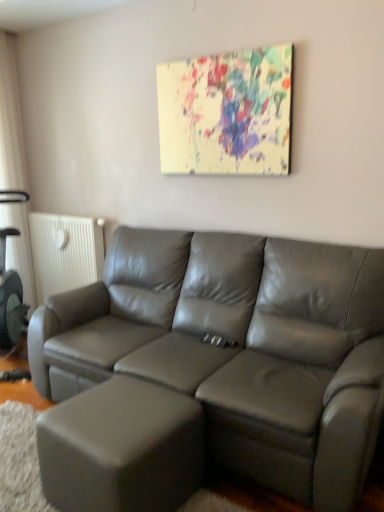
Question: In the image, is painted canvas at upper center positioned in front of or behind matte gray ottoman at lower left?

Choices:
 (A) front
 (B) behind

Answer: (B)

Question: Is painted canvas at upper center taller or shorter than matte gray ottoman at lower left?

Choices:
 (A) tall
 (B) short

Answer: (A)

Question: Estimate the real-world distances between objects in this image. Which object is closer to the matte gray ottoman at lower left?

Choices:
 (A) painted canvas at upper center
 (B) white textured radiator at left
 (C) satin gray leather couch at center

Answer: (C)

Question: Based on their relative distances, which object is nearer to the matte gray ottoman at lower left?

Choices:
 (A) white textured radiator at left
 (B) painted canvas at upper center
 (C) satin gray leather couch at center

Answer: (C)